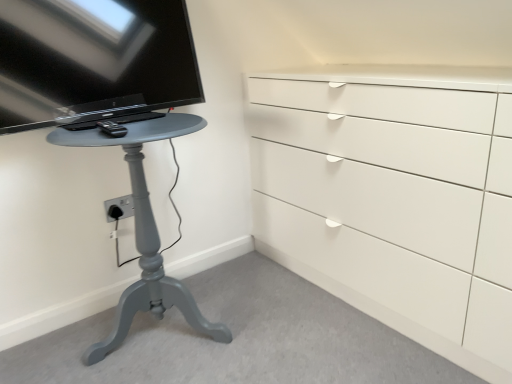
Question: Could you tell me if matte gray table at left is facing black plastic remote control at left?

Choices:
 (A) no
 (B) yes

Answer: (A)

Question: Can you confirm if matte gray table at left is shorter than black plastic remote control at left?

Choices:
 (A) no
 (B) yes

Answer: (A)

Question: Can you see matte gray table at left touching black plastic remote control at left?

Choices:
 (A) no
 (B) yes

Answer: (A)

Question: Can you confirm if matte gray table at left is taller than black plastic remote control at left?

Choices:
 (A) yes
 (B) no

Answer: (A)

Question: Does matte gray table at left appear on the left side of black plastic remote control at left?

Choices:
 (A) yes
 (B) no

Answer: (B)

Question: Can you confirm if matte gray table at left is thinner than black plastic remote control at left?

Choices:
 (A) no
 (B) yes

Answer: (A)

Question: Can you confirm if black plastic remote control at left is bigger than matte gray table at left?

Choices:
 (A) no
 (B) yes

Answer: (A)

Question: From the image's perspective, is black plastic remote control at left below matte gray table at left?

Choices:
 (A) no
 (B) yes

Answer: (A)

Question: Is black plastic remote control at left not near matte gray table at left?

Choices:
 (A) no
 (B) yes

Answer: (A)

Question: Is black plastic remote control at left next to matte gray table at left?

Choices:
 (A) yes
 (B) no

Answer: (B)

Question: Is black plastic remote control at left completely or partially outside of matte gray table at left?

Choices:
 (A) no
 (B) yes

Answer: (B)

Question: Can you confirm if black plastic remote control at left is thinner than matte gray table at left?

Choices:
 (A) no
 (B) yes

Answer: (B)

Question: Does matte gray table at left appear on the right side of black glossy tv at upper left?

Choices:
 (A) yes
 (B) no

Answer: (A)